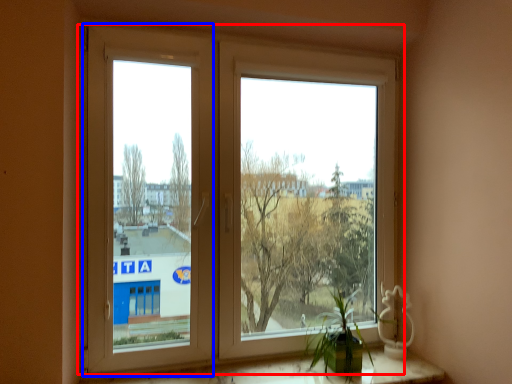
Question: Which point is further to the camera, window (highlighted by a red box) or window frame (highlighted by a blue box)?

Choices:
 (A) window
 (B) window frame

Answer: (A)